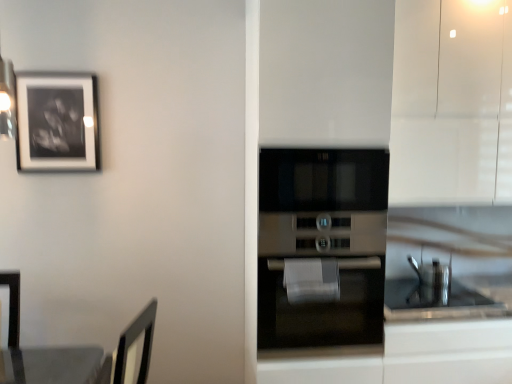
Question: Can you confirm if white glossy cabinet at upper right is shorter than stainless steel oven at center?

Choices:
 (A) yes
 (B) no

Answer: (B)

Question: Is white glossy cabinet at upper right wider than stainless steel oven at center?

Choices:
 (A) yes
 (B) no

Answer: (B)

Question: From a real-world perspective, is white glossy cabinet at upper right physically above stainless steel oven at center?

Choices:
 (A) no
 (B) yes

Answer: (B)

Question: Is the position of white glossy cabinet at upper right more distant than that of stainless steel oven at center?

Choices:
 (A) yes
 (B) no

Answer: (A)

Question: Is stainless steel oven at center surrounded by white glossy cabinet at upper right?

Choices:
 (A) no
 (B) yes

Answer: (A)

Question: Is stainless steel oven at center in front of or behind white glossy cabinet at upper right in the image?

Choices:
 (A) front
 (B) behind

Answer: (A)

Question: Would you say stainless steel oven at center is inside or outside white glossy cabinet at upper right?

Choices:
 (A) inside
 (B) outside

Answer: (B)

Question: From the image's perspective, is stainless steel oven at center positioned above or below white glossy cabinet at upper right?

Choices:
 (A) above
 (B) below

Answer: (B)

Question: From a real-world perspective, is stainless steel oven at center above or below white glossy cabinet at upper right?

Choices:
 (A) below
 (B) above

Answer: (A)

Question: Does point (62, 114) appear closer or farther from the camera than point (440, 6)?

Choices:
 (A) closer
 (B) farther

Answer: (B)

Question: From the image's perspective, is black matte picture frame at upper left positioned above or below white glossy cabinet at upper right?

Choices:
 (A) above
 (B) below

Answer: (B)

Question: Is black matte picture frame at upper left in front of or behind white glossy cabinet at upper right in the image?

Choices:
 (A) behind
 (B) front

Answer: (A)

Question: In terms of size, does black matte picture frame at upper left appear bigger or smaller than white glossy cabinet at upper right?

Choices:
 (A) big
 (B) small

Answer: (B)

Question: Would you say black matte picture frame at upper left is inside or outside stainless steel oven at center?

Choices:
 (A) outside
 (B) inside

Answer: (A)

Question: Is black matte picture frame at upper left wider or thinner than stainless steel oven at center?

Choices:
 (A) wide
 (B) thin

Answer: (B)